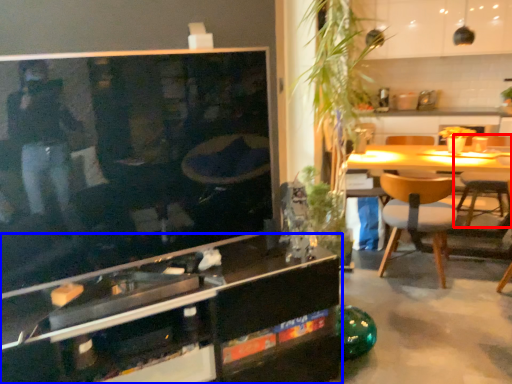
Question: Which object appears closest to the camera in this image, chair (highlighted by a red box) or cabinetry (highlighted by a blue box)?

Choices:
 (A) chair
 (B) cabinetry

Answer: (B)